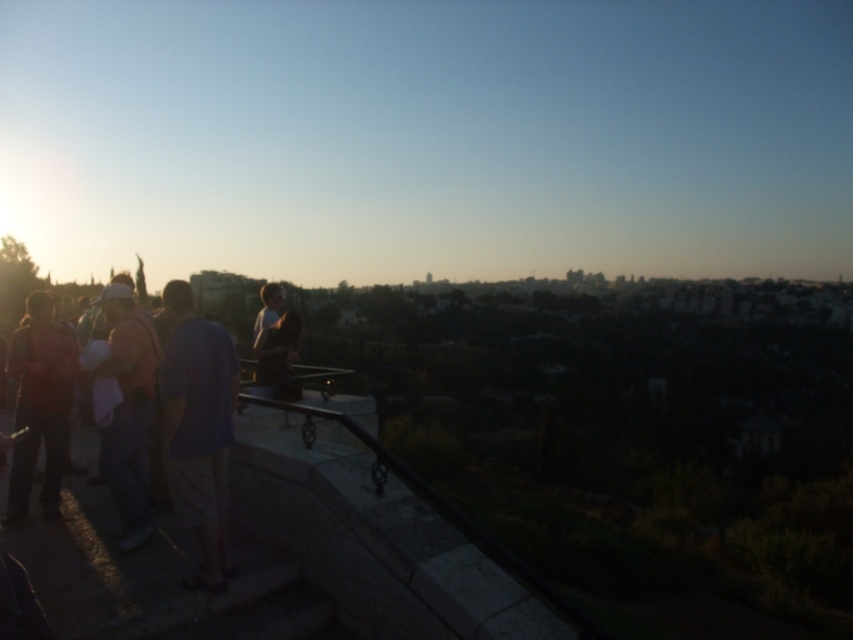
Between blue cotton shirt at center and light brown fabric shirt at left, which one is positioned higher?

blue cotton shirt at center is higher up.

Is blue cotton shirt at center to the left of light brown fabric shirt at left from the viewer's perspective?

In fact, blue cotton shirt at center is to the right of light brown fabric shirt at left.

Is point (223, 564) more distant than point (102, 372)?

No, it is not.

You are a GUI agent. You are given a task and a screenshot of the screen. Output one action in this format:
    pyautogui.click(x=<x>, y=<y>)
    Task: Click on the blue cotton shirt at center
    
    Given the screenshot: What is the action you would take?
    pyautogui.click(x=196, y=428)

Is blue cotton shirt at center smaller than matte black shirt at left?

Indeed, blue cotton shirt at center has a smaller size compared to matte black shirt at left.

Is blue cotton shirt at center below matte black shirt at left?

Actually, blue cotton shirt at center is above matte black shirt at left.

Does point (223, 385) come behind point (18, 493)?

No, (223, 385) is closer to viewer.

The height and width of the screenshot is (640, 853). What are the coordinates of `blue cotton shirt at center` in the screenshot? It's located at [x=196, y=428].

Can you confirm if light brown fabric shirt at left is positioned below matte black shirt at left?

Correct, light brown fabric shirt at left is located below matte black shirt at left.

Consider the image. Which of these two, light brown fabric shirt at left or matte black shirt at left, stands taller?

light brown fabric shirt at left is taller.

Between point (129, 417) and point (22, 348), which one is positioned in front?

Point (129, 417) is more forward.

This screenshot has width=853, height=640. Find the location of `light brown fabric shirt at left`. light brown fabric shirt at left is located at coordinates (128, 410).